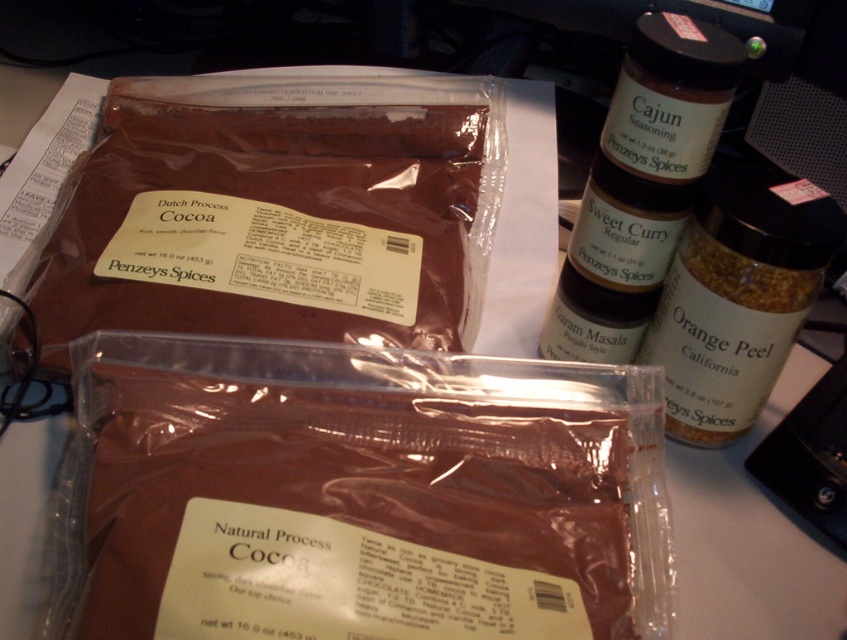
You are organizing a baking station and need to place the brown matte cocoa at upper left and the orange peel spice at upper right on a shelf. The shelf has a width of 15 cm. Can both items fit side by side without overlapping?

The brown matte cocoa at upper left might be wider than orange peel spice at upper right, so there is uncertainty about whether both items can fit side by side on the 15 cm shelf without overlapping. Measure their combined width to confirm.

You are a chef preparing a recipe that requires precise measurements. You have a brown glass jar at upper right and an orange peel spice at upper right on your desk. If the minimum safe distance required between two containers to avoid cross contamination is 2 inches, is the current spacing between them sufficient?

The distance between the brown glass jar at upper right and the orange peel spice at upper right is 1.97 inches, which is less than the required 2 inches. Therefore, the current spacing is insufficient to meet the safety standard.

You are organizing spices on a desk and notice the brown glass jar at upper right and the orange peel spice at upper right. Which one is nearer to you?

The brown glass jar at upper right is closer to the viewer than orange peel spice at upper right, so the brown glass jar at upper right is nearer to you.